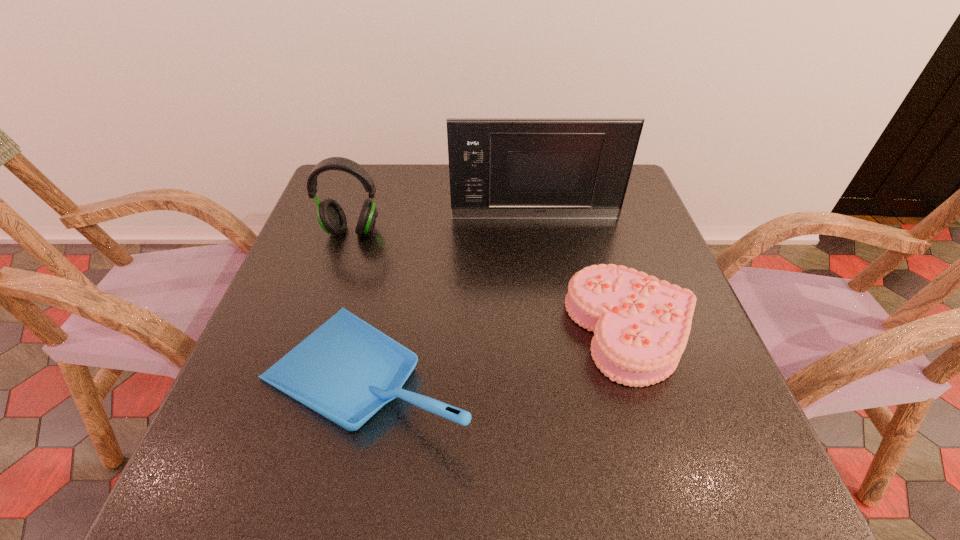
In order to click on microwave oven in this screenshot , I will do `click(500, 168)`.

Where is `the tallest object`? the tallest object is located at coordinates (500, 168).

This screenshot has height=540, width=960. Find the location of `the third nearest object`. the third nearest object is located at coordinates (330, 215).

The height and width of the screenshot is (540, 960). What are the coordinates of `headset` in the screenshot? It's located at pos(330,215).

Find the location of `dustpan`. dustpan is located at coordinates (346, 370).

Identify the location of the shortest object. The image size is (960, 540). (641, 325).

Where is `vacant space located on the front panel of the farthest object`? vacant space located on the front panel of the farthest object is located at coordinates (553, 339).

Where is `free space located 0.120m on the ear cups of the second farthest object`? The image size is (960, 540). free space located 0.120m on the ear cups of the second farthest object is located at coordinates (336, 276).

I want to click on free location located 0.370m on the back of the third tallest object, so click(403, 208).

Where is `vacant space situated on the left of the cake`? This screenshot has height=540, width=960. vacant space situated on the left of the cake is located at coordinates [x=474, y=330].